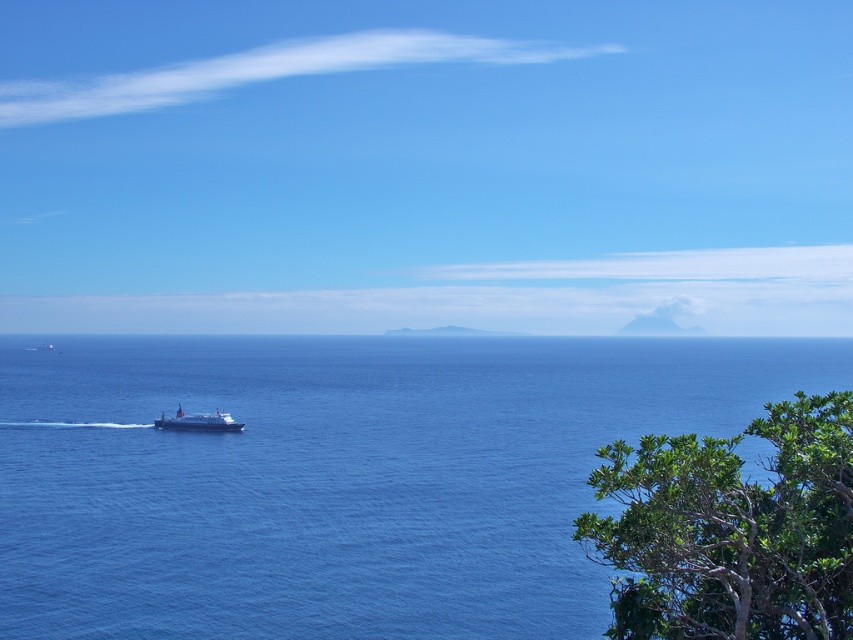
Question: Does blue liquid water at center have a larger size compared to white glossy ferry at center?

Choices:
 (A) no
 (B) yes

Answer: (B)

Question: Which point is farther from the camera taking this photo?

Choices:
 (A) (473, 403)
 (B) (181, 426)
 (C) (643, 513)

Answer: (A)

Question: Does green leafy tree at lower right lie in front of white glossy ferry at center?

Choices:
 (A) yes
 (B) no

Answer: (A)

Question: Can you confirm if blue liquid water at center is positioned above white glossy ferry at center?

Choices:
 (A) no
 (B) yes

Answer: (B)

Question: Among these points, which one is farthest from the camera?

Choices:
 (A) (631, 500)
 (B) (183, 538)
 (C) (177, 412)

Answer: (C)

Question: Among these points, which one is farthest from the camera?

Choices:
 (A) (759, 486)
 (B) (387, 497)
 (C) (173, 429)

Answer: (C)